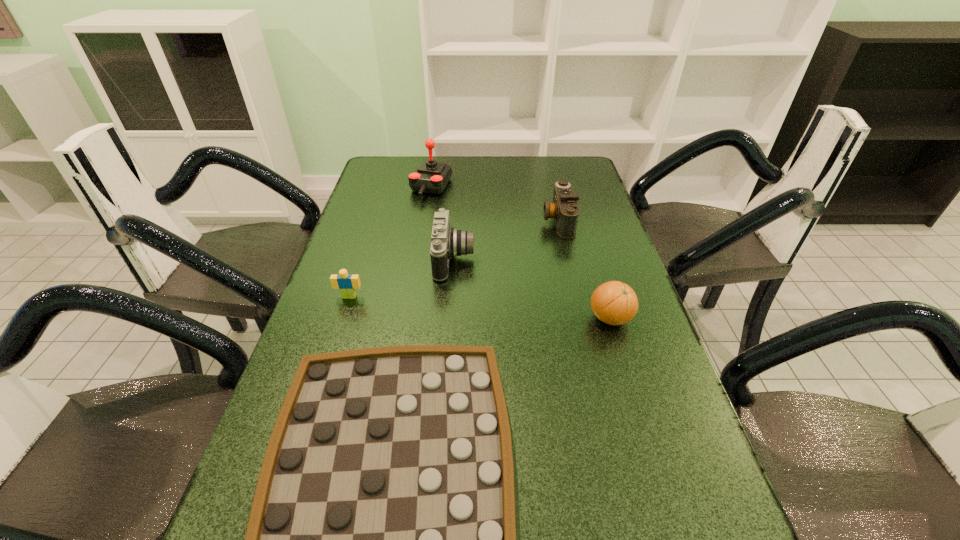
This screenshot has width=960, height=540. Identify the location of object located at the far left corner. (431, 177).

Locate an element on the screen. vacant area at the far edge is located at coordinates (446, 158).

Image resolution: width=960 pixels, height=540 pixels. Find the location of `free space at the left edge of the desktop`. free space at the left edge of the desktop is located at coordinates (374, 240).

You are a GUI agent. You are given a task and a screenshot of the screen. Output one action in this format:
    pyautogui.click(x=<x>, y=<y>)
    Task: Click on the blank space at the right edge
    This screenshot has height=540, width=960.
    Given the screenshot: What is the action you would take?
    pyautogui.click(x=582, y=303)

Where is `free point between the taller camera and the orange`? free point between the taller camera and the orange is located at coordinates (532, 289).

At what (x,y) coordinates should I click in order to perform the action: click on unoccupied position between the fifth shortest object and the second shortest object. Please return your answer as a coordinate pair (x, y). The image size is (960, 540). Looking at the image, I should click on (401, 278).

Image resolution: width=960 pixels, height=540 pixels. I want to click on free point between the shorter camera and the fifth farthest object, so click(585, 269).

Locate an element on the screen. vacant area that lies between the shorter camera and the left camera is located at coordinates (506, 240).

The width and height of the screenshot is (960, 540). Identify the location of free space between the second shortest object and the shorter camera. (454, 259).

Identify which object is the fourth nearest to the checkerboard. Please provide its 2D coordinates. Your answer should be formatted as a tuple, i.e. [(x, y)], where the tuple contains the x and y coordinates of a point satisfying the conditions above.

[(564, 209)]